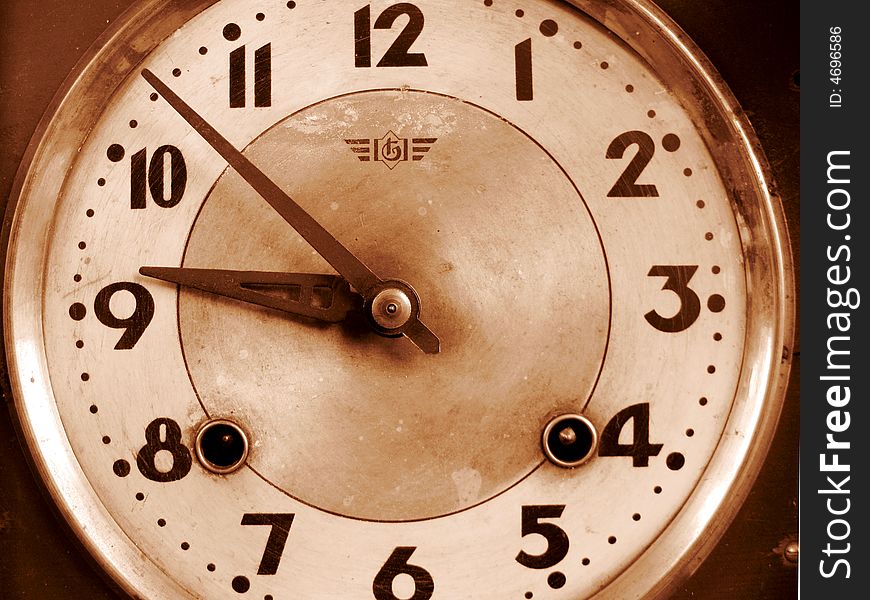
Where is `metal clock edge`? The image size is (870, 600). metal clock edge is located at coordinates (36, 141), (786, 307), (76, 542).